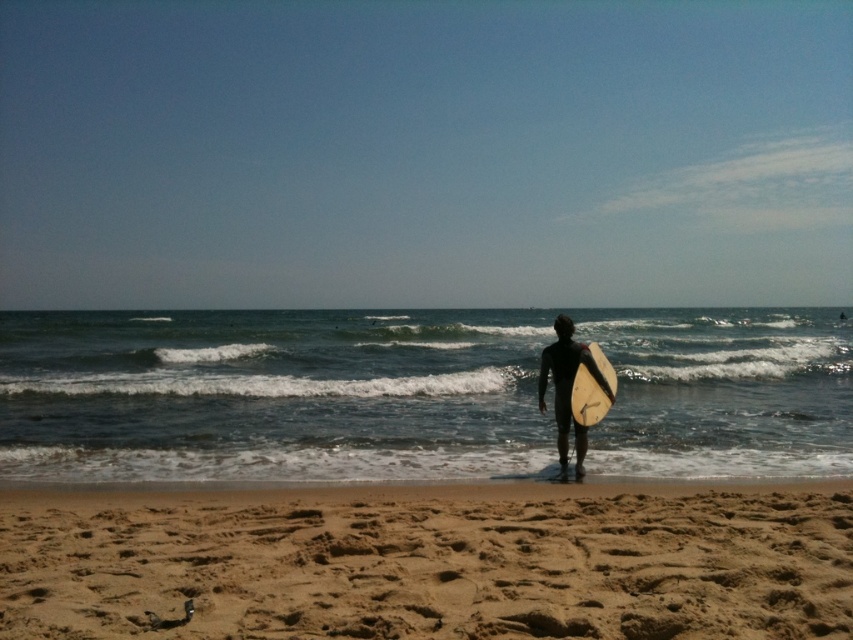
Locate an element on the screen. fine-grained sand at lower center is located at coordinates (431, 563).

Describe the element at coordinates (431, 563) in the screenshot. I see `fine-grained sand at lower center` at that location.

The height and width of the screenshot is (640, 853). In order to click on fine-grained sand at lower center in this screenshot , I will do `click(431, 563)`.

Can you confirm if dark blue water at center is bigger than fine-grained sand at lower center?

Correct, dark blue water at center is larger in size than fine-grained sand at lower center.

Which of these two, dark blue water at center or fine-grained sand at lower center, stands taller?

With more height is dark blue water at center.

Is point (767, 348) positioned in front of point (747, 488)?

No, (767, 348) is further to viewer.

The image size is (853, 640). Identify the location of dark blue water at center. (271, 394).

Can you confirm if dark blue water at center is taller than white foam surfboard at center?

Indeed, dark blue water at center has a greater height compared to white foam surfboard at center.

Is dark blue water at center behind white foam surfboard at center?

That is True.

The height and width of the screenshot is (640, 853). What do you see at coordinates (271, 394) in the screenshot?
I see `dark blue water at center` at bounding box center [271, 394].

The height and width of the screenshot is (640, 853). Find the location of `dark blue water at center`. dark blue water at center is located at coordinates (271, 394).